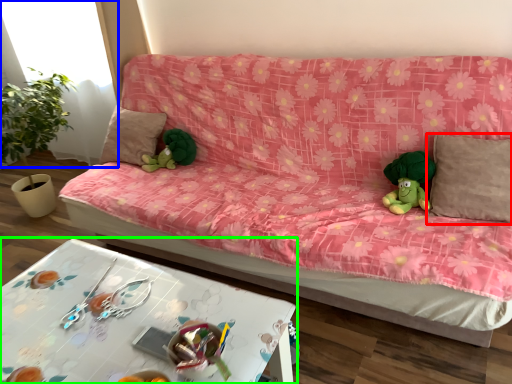
Question: Which is farther away from pillow (highlighted by a red box)? window (highlighted by a blue box) or table (highlighted by a green box)?

Choices:
 (A) window
 (B) table

Answer: (A)